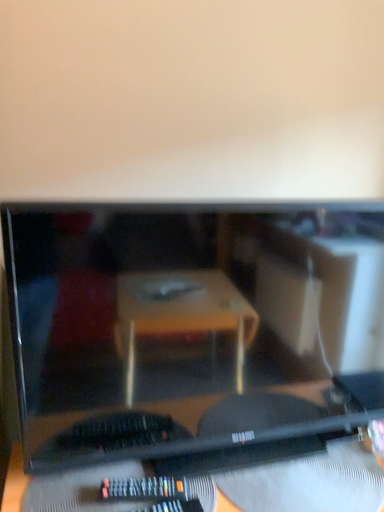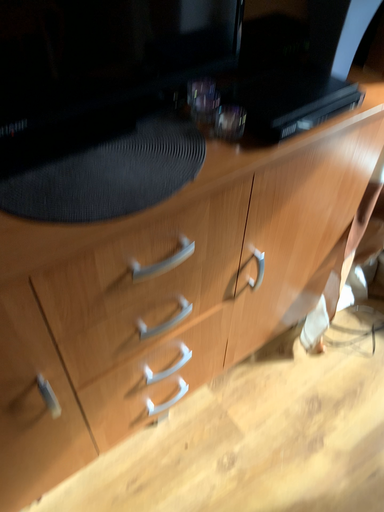
Question: Which way did the camera rotate in the video?

Choices:
 (A) rotated upward
 (B) rotated downward

Answer: (B)